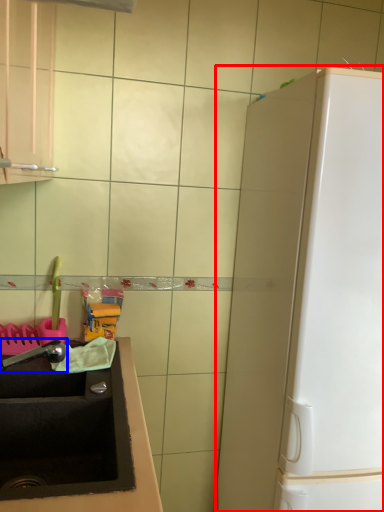
Question: Which object appears farthest to the camera in this image, appliance (highlighted by a red box) or faucet (highlighted by a blue box)?

Choices:
 (A) appliance
 (B) faucet

Answer: (B)